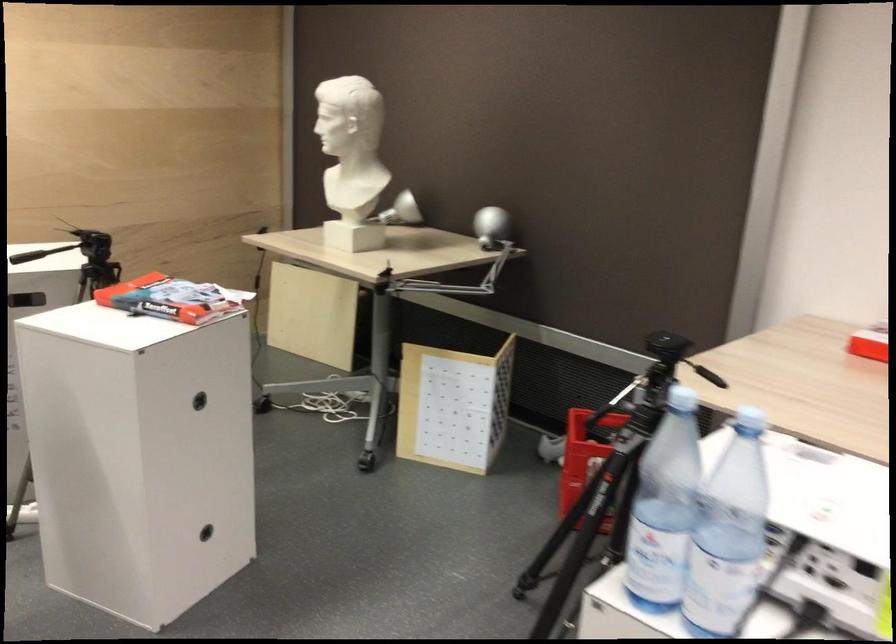
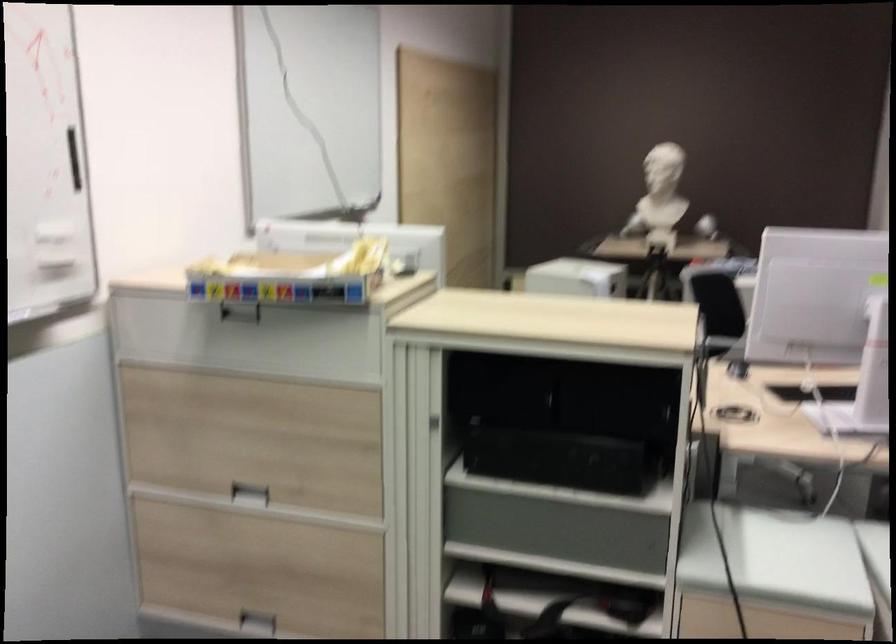
Question: In a continuous first-person perspective shot, in which direction is the camera moving?

Choices:
 (A) Left
 (B) Right
 (C) Forward
 (D) Backward

Answer: (A)